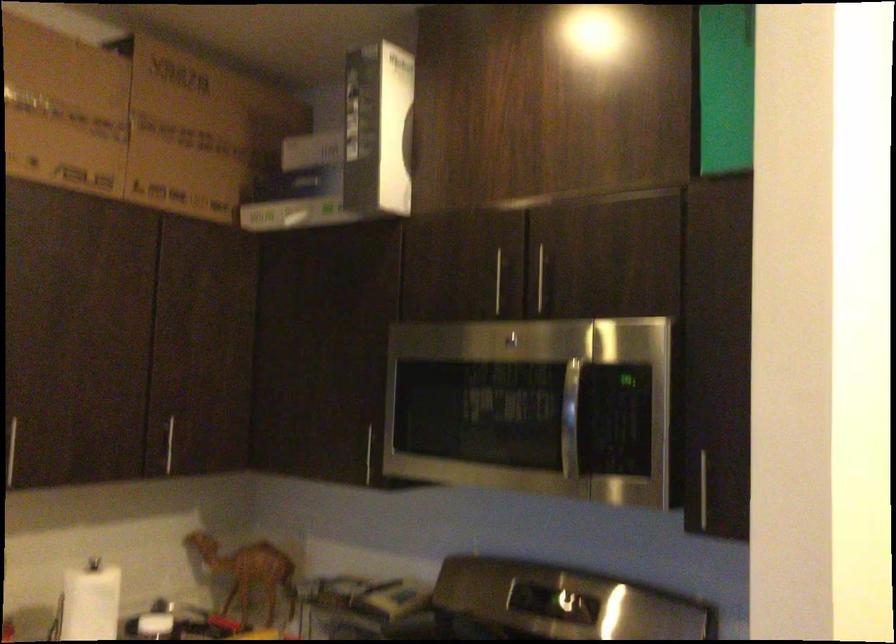
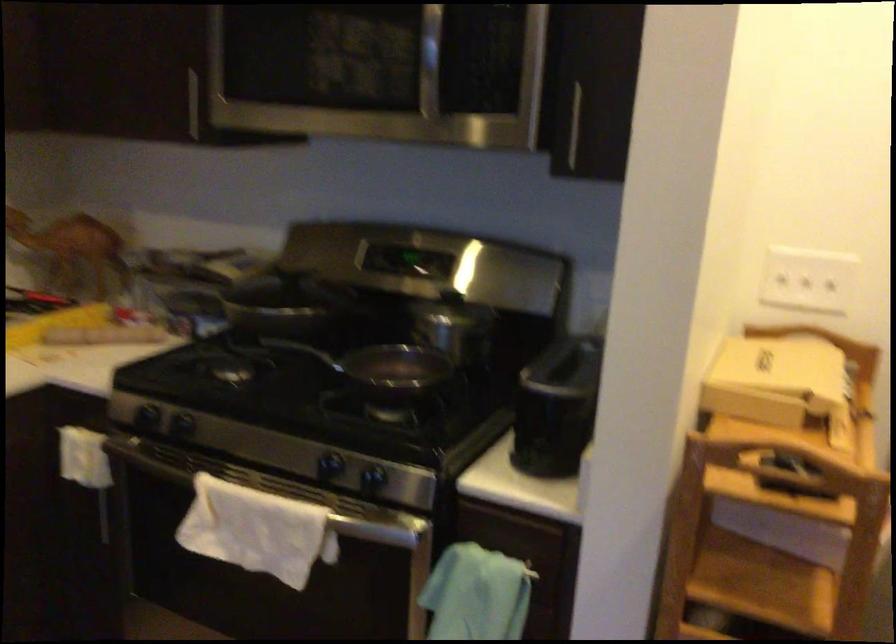
Question: Based on the continuous images, in which direction is the camera rotating? Reply with the corresponding letter.

Choices:
 (A) Left
 (B) Right
 (C) Up
 (D) Down

Answer: (D)